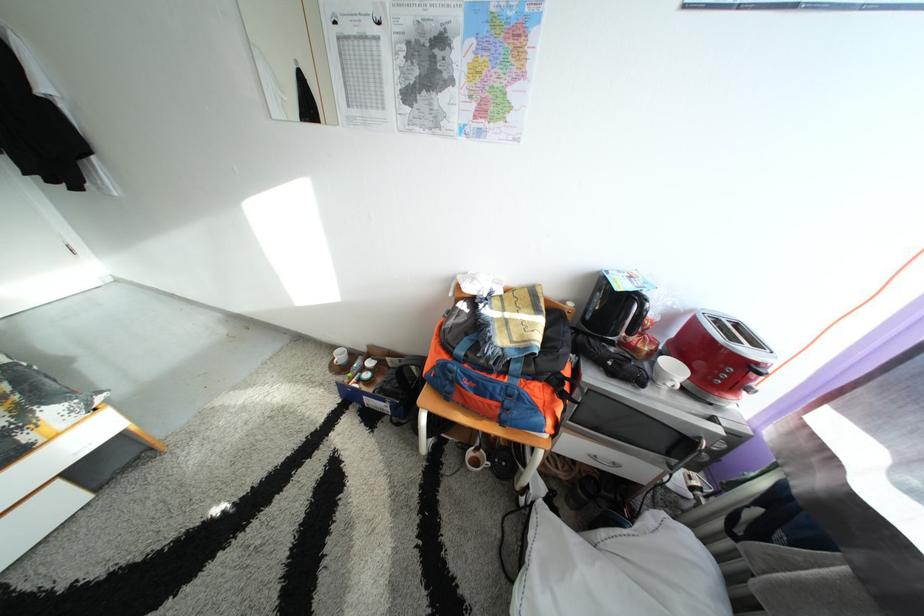
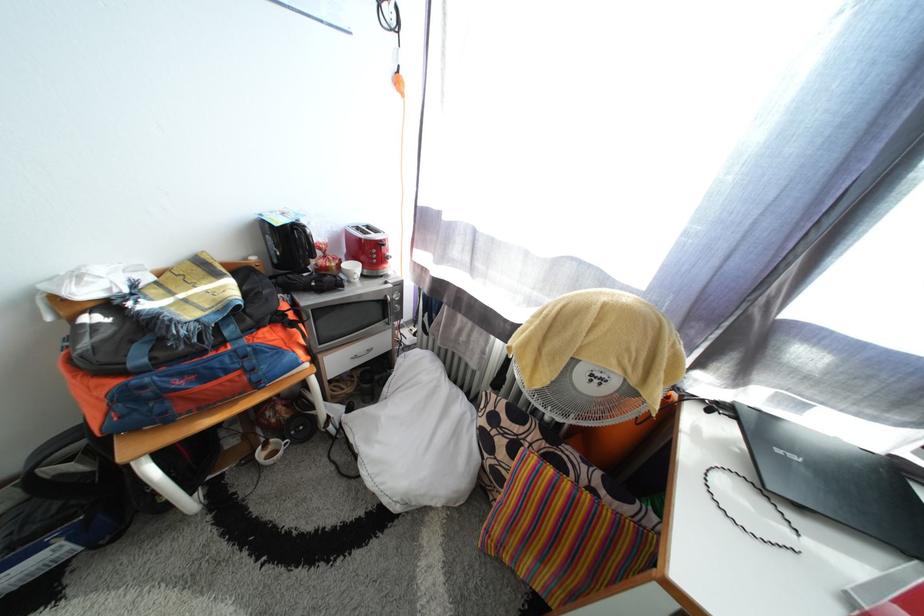
In the second image, find the point that corresponds to the point at 698,440 in the first image.

(390, 304)